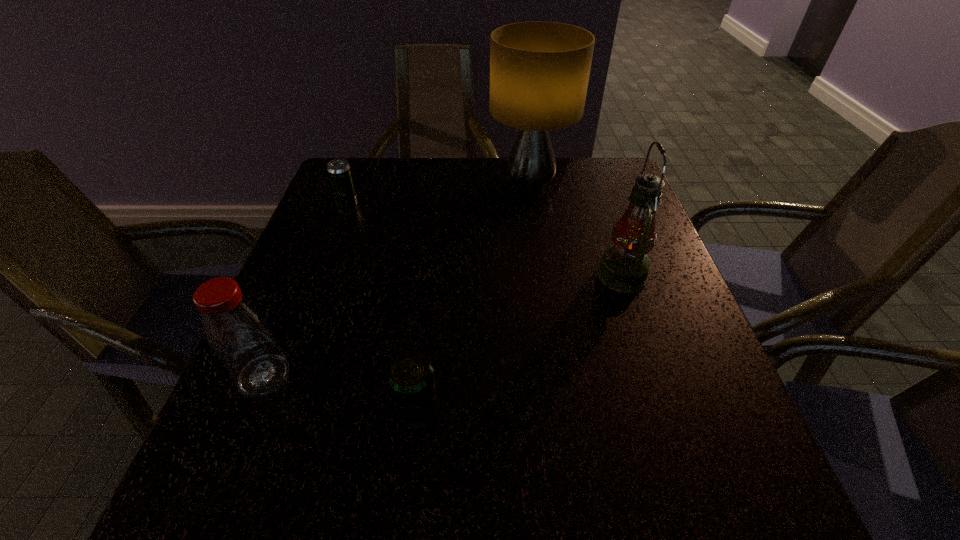
In order to click on the tallest object in this screenshot , I will do `click(539, 71)`.

Where is `lampshade`? Image resolution: width=960 pixels, height=540 pixels. lampshade is located at coordinates (539, 71).

I want to click on the fourth shortest object, so click(x=624, y=267).

This screenshot has width=960, height=540. I want to click on oil lamp, so click(x=624, y=267).

The height and width of the screenshot is (540, 960). I want to click on the third tallest object, so click(x=238, y=333).

You are a GUI agent. You are given a task and a screenshot of the screen. Output one action in this format:
    pyautogui.click(x=<x>, y=<y>)
    Task: Click on the farther beer can
    The height and width of the screenshot is (540, 960).
    Given the screenshot: What is the action you would take?
    pyautogui.click(x=339, y=171)

The height and width of the screenshot is (540, 960). What are the coordinates of `the right beer can` in the screenshot? It's located at (410, 377).

Find the location of a particular element. the third object from right to left is located at coordinates (410, 377).

Where is `vacant space located 0.120m on the left of the tallest object`? Image resolution: width=960 pixels, height=540 pixels. vacant space located 0.120m on the left of the tallest object is located at coordinates (445, 186).

This screenshot has width=960, height=540. I want to click on vacant space located on the front of the rightmost object, so click(672, 424).